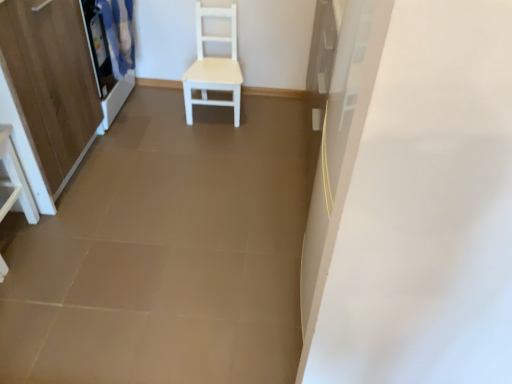
Question: Considering the relative sizes of white matte chair at center and white glossy vanity at lower left in the image provided, is white matte chair at center wider than white glossy vanity at lower left?

Choices:
 (A) yes
 (B) no

Answer: (A)

Question: Does white matte chair at center have a greater height compared to white glossy vanity at lower left?

Choices:
 (A) no
 (B) yes

Answer: (B)

Question: Could white glossy vanity at lower left be considered to be inside white matte chair at center?

Choices:
 (A) yes
 (B) no

Answer: (B)

Question: Does white matte chair at center have a larger size compared to white glossy vanity at lower left?

Choices:
 (A) yes
 (B) no

Answer: (A)

Question: From a real-world perspective, does white matte chair at center sit lower than white glossy vanity at lower left?

Choices:
 (A) no
 (B) yes

Answer: (A)

Question: In terms of width, does white matte chair at center look wider or thinner when compared to white glossy vanity at lower left?

Choices:
 (A) thin
 (B) wide

Answer: (B)

Question: From the image's perspective, is white matte chair at center located above or below white glossy vanity at lower left?

Choices:
 (A) above
 (B) below

Answer: (A)

Question: In the image, is white matte chair at center positioned in front of or behind white glossy vanity at lower left?

Choices:
 (A) behind
 (B) front

Answer: (A)

Question: Considering the positions of white matte chair at center and white glossy vanity at lower left in the image, is white matte chair at center taller or shorter than white glossy vanity at lower left?

Choices:
 (A) tall
 (B) short

Answer: (A)

Question: Choose the correct answer: Is white matte chair at center inside matte white curtain at upper left or outside it?

Choices:
 (A) inside
 (B) outside

Answer: (B)

Question: Is point (199, 61) closer or farther from the camera than point (115, 74)?

Choices:
 (A) farther
 (B) closer

Answer: (A)

Question: From the image's perspective, is white matte chair at center located above or below matte white curtain at upper left?

Choices:
 (A) above
 (B) below

Answer: (B)

Question: Is white matte chair at center wider or thinner than matte white curtain at upper left?

Choices:
 (A) thin
 (B) wide

Answer: (B)

Question: In terms of width, does wooden cabinet at left look wider or thinner when compared to matte white curtain at upper left?

Choices:
 (A) thin
 (B) wide

Answer: (B)

Question: From a real-world perspective, is wooden cabinet at left positioned above or below matte white curtain at upper left?

Choices:
 (A) below
 (B) above

Answer: (B)